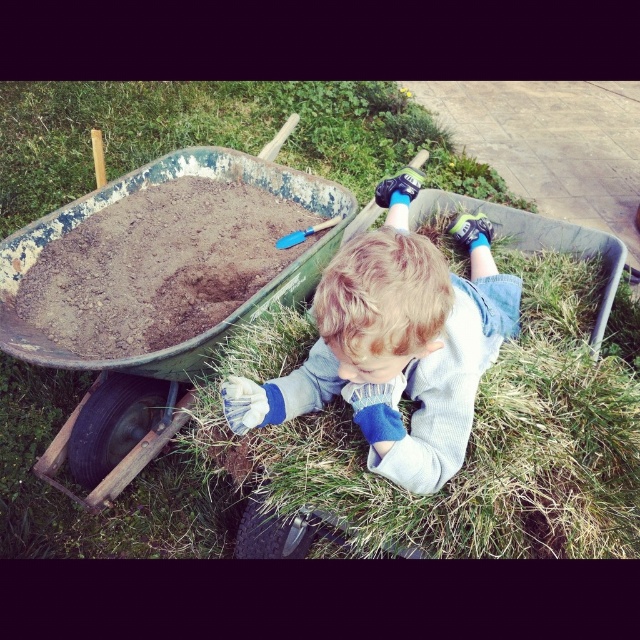
You are standing in front of the wheelbarrow and want to place a small flag at point A and point B. If point A is at coordinates point (106, 333) and point B is at point (156, 179), which point is closer to you?

Point A at coordinates point (106, 333) is closer to you than point B at point (156, 179).

You are a delivery person who needs to place a package between the rusty metal wheelbarrow at left and the blue denim jeans at lower center. The package requires 3 feet of space. Can you fit it there?

The distance between the rusty metal wheelbarrow at left and the blue denim jeans at lower center is 33.69 inches, which is equivalent to 2.8075 feet. Since the required space is 3 feet, the package cannot be placed there as the available space is insufficient.

You are standing at the point labeled as point (188, 256) and want to take a photo of the scene. If your camera is 2.79 meters away from this point, will the entire wheelbarrow with the child be visible in the photo?

Yes, since the camera is exactly 2.79 meters away from point (188, 256), which is the location where you are standing, the entire wheelbarrow with the child should be visible in the photo.